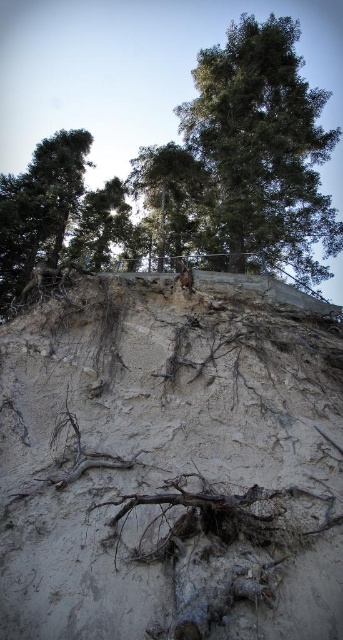
You are a hiker standing at the base of the cliff and looking up. You see two green leafy trees above you. Which one is positioned to the right when comparing the green leafy tree at upper center and the green leafy tree at center?

The green leafy tree at upper center is positioned to the right of the green leafy tree at center.